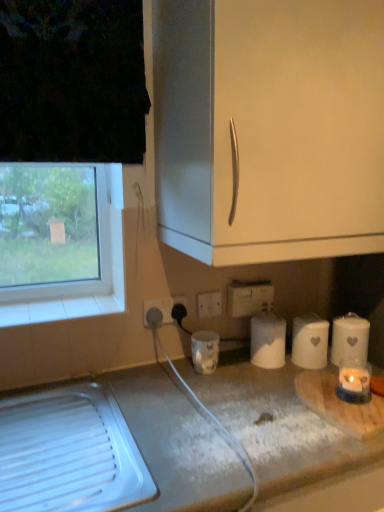
Where is `free space that is in between translucent glass candle at lower right and white ceramic candle at lower center`? The width and height of the screenshot is (384, 512). free space that is in between translucent glass candle at lower right and white ceramic candle at lower center is located at coordinates (249, 381).